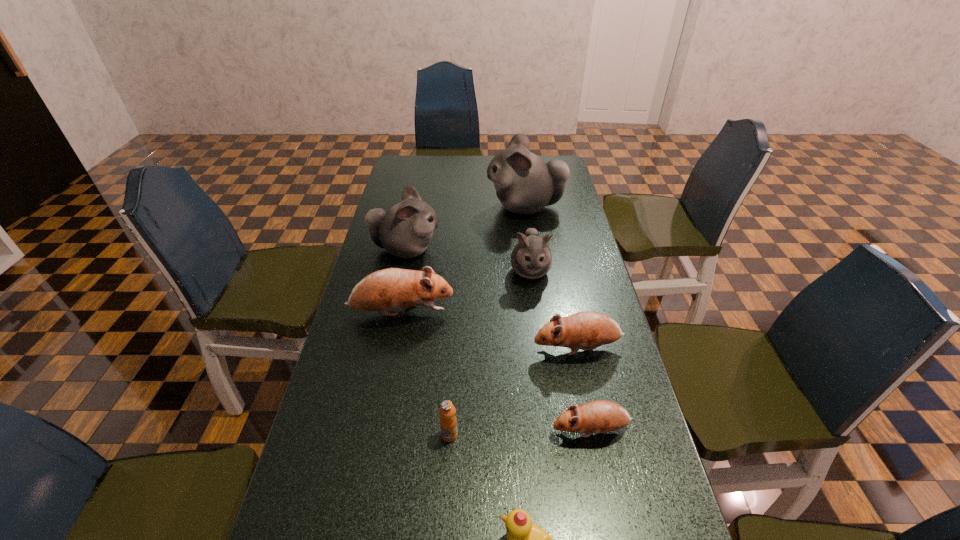
Image resolution: width=960 pixels, height=540 pixels. Find the location of `free space located at the face of the second nearest brown hamster`. free space located at the face of the second nearest brown hamster is located at coordinates (461, 348).

Find the location of a particular element. This screenshot has width=960, height=540. vacant space located on the front label of the orange juice is located at coordinates (445, 504).

Where is `vacant area situated at the face of the smallest brown hamster`? vacant area situated at the face of the smallest brown hamster is located at coordinates (399, 430).

Find the location of a particular element. This screenshot has width=960, height=540. vacant point located at the face of the smallest brown hamster is located at coordinates (426, 430).

You are a GUI agent. You are given a task and a screenshot of the screen. Output one action in this format:
    pyautogui.click(x=<x>, y=<y>)
    Task: Click on the vacant space situated at the face of the smallest brown hamster
    The width and height of the screenshot is (960, 540).
    Given the screenshot: What is the action you would take?
    pyautogui.click(x=497, y=430)

In the image, there is a desktop. Identify the location of vacant area at the far edge. (486, 169).

This screenshot has width=960, height=540. In order to click on vacant area at the left edge of the desktop in this screenshot , I will do pos(380,317).

Where is `vacant space at the right edge of the desktop`? vacant space at the right edge of the desktop is located at coordinates (598, 279).

I want to click on free space between the second shortest hamster and the smallest brown hamster, so click(x=584, y=389).

Locate an element on the screen. The image size is (960, 540). empty space between the smallest white hamster and the leftmost white hamster is located at coordinates (468, 260).